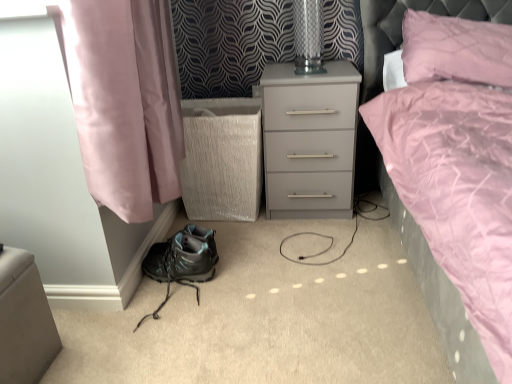
Locate an element on the screen. The width and height of the screenshot is (512, 384). free space to the right of matte black hiking boot at lower left is located at coordinates (244, 297).